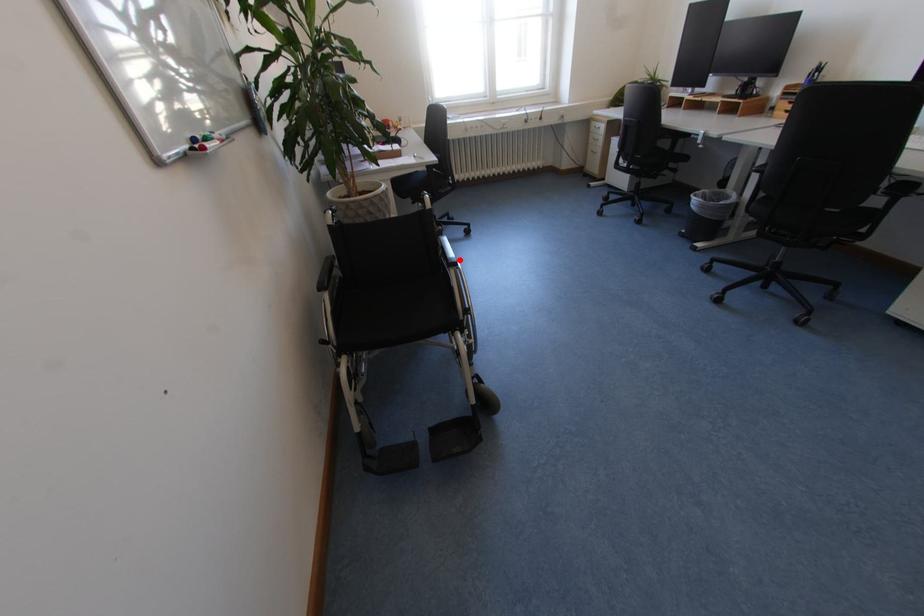
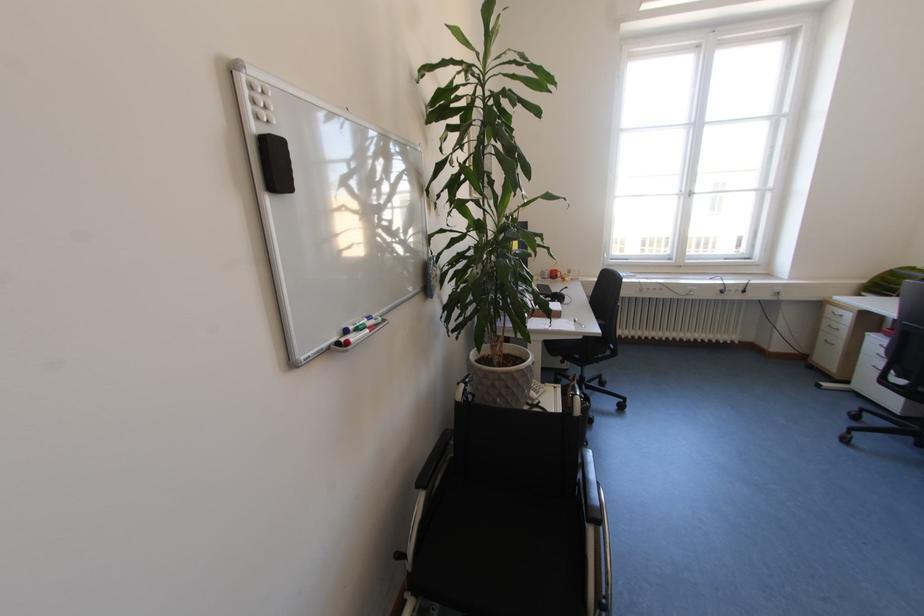
Question: I am providing you with two images of the same scene from different viewpoints. Given a red point in image1, look at the same physical point in image2. Is it:

Choices:
 (A) Closer to the viewpoint
 (B) Farther from the viewpoint

Answer: (B)